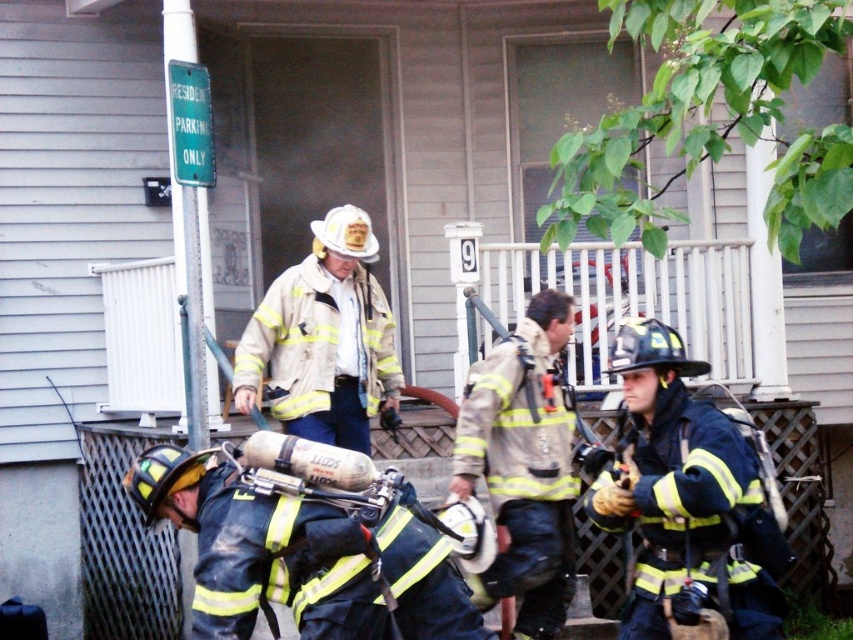
You are a firefighter trainee observing the scene. You notice two helmets at the center of the image. Which helmet has a smaller width between the reflective silver helmet at center and the white matte helmet at center?

The reflective silver helmet at center has a smaller width compared to the white matte helmet at center.